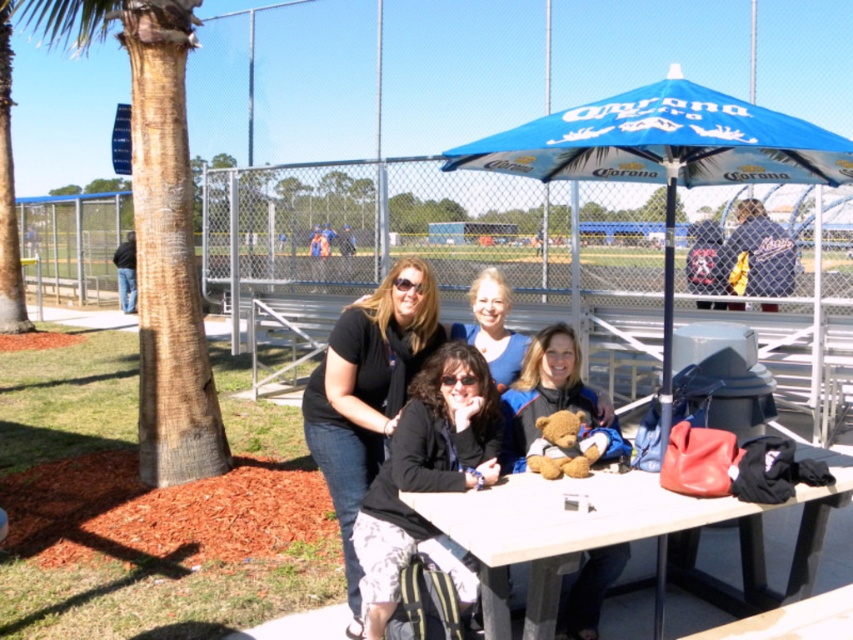
Question: Which object is positioned closest to the brown plush bear at center?

Choices:
 (A) black matte jacket at center
 (B) blue fabric shirt at center
 (C) black matte shirt at center
 (D) brown textured palm tree at left

Answer: (B)

Question: Which object is the farthest from the brown textured palm tree at left?

Choices:
 (A) black matte shirt at center
 (B) black matte jacket at center

Answer: (B)

Question: In this image, where is brown plush bear at center located relative to blue fabric shirt at center?

Choices:
 (A) below
 (B) above

Answer: (A)

Question: Does matte black jacket at center have a larger size compared to blue fabric shirt at center?

Choices:
 (A) yes
 (B) no

Answer: (A)

Question: Is brown textured palm tree at left further to camera compared to matte black jacket at center?

Choices:
 (A) no
 (B) yes

Answer: (B)

Question: Based on their relative distances, which object is farther from the blue fabric shirt at center?

Choices:
 (A) black matte shirt at center
 (B) smooth white table at center

Answer: (B)